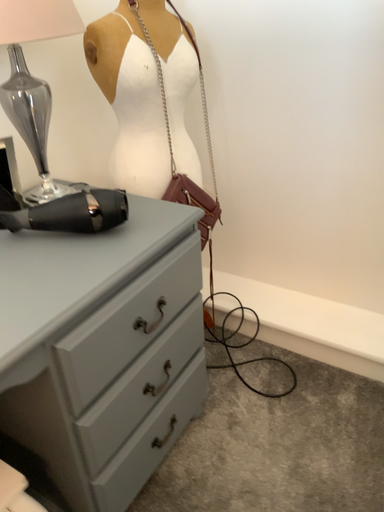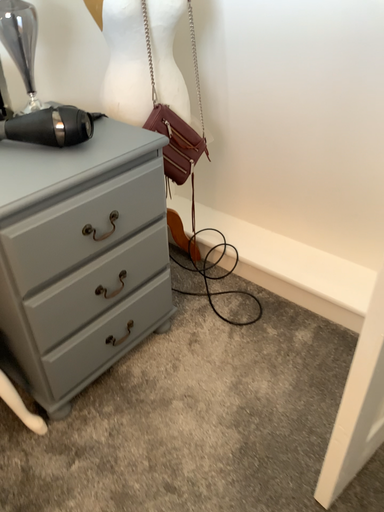
Question: How did the camera likely rotate when shooting the video?

Choices:
 (A) rotated upward
 (B) rotated downward

Answer: (B)